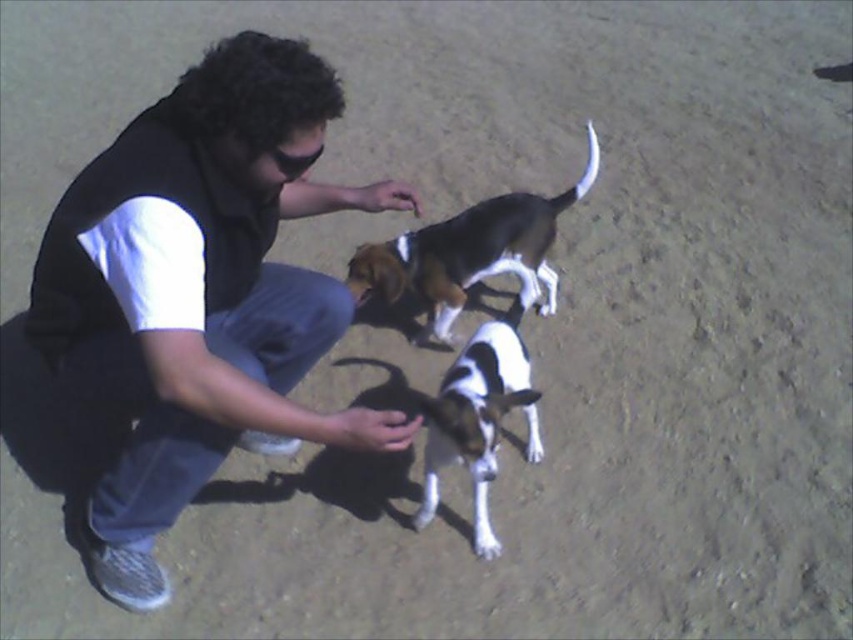
Question: Which point is farther to the camera?

Choices:
 (A) (479, 545)
 (B) (518, 269)
 (C) (56, 230)

Answer: (B)

Question: Which point is closer to the camera?

Choices:
 (A) black matte shirt at center
 (B) white fur paw at lower center

Answer: (A)

Question: Can you confirm if black matte shirt at center is positioned to the left of white fur paw at lower center?

Choices:
 (A) no
 (B) yes

Answer: (B)

Question: Is black matte shirt at center above white and brown fur dog at center?

Choices:
 (A) no
 (B) yes

Answer: (B)

Question: Can you confirm if black matte shirt at center is positioned above white fur paw at lower center?

Choices:
 (A) no
 (B) yes

Answer: (B)

Question: Which object is positioned farthest from the black and white fur dog at center?

Choices:
 (A) white fur paw at lower center
 (B) black matte shirt at center
 (C) white and brown fur dog at center

Answer: (A)